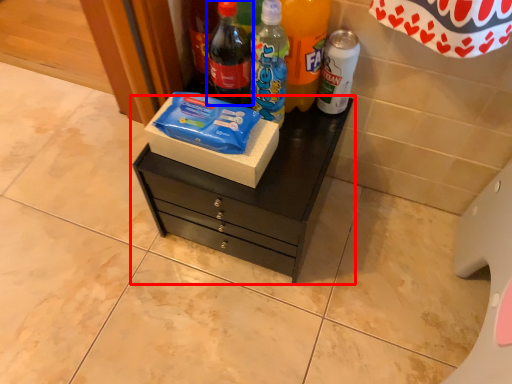
Question: Which of the following is the closest to the observer, chest of drawers (highlighted by a red box) or bottle (highlighted by a blue box)?

Choices:
 (A) chest of drawers
 (B) bottle

Answer: (B)